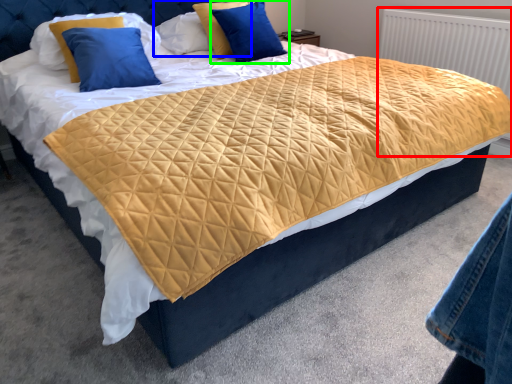
Question: Which object is positioned farthest from radiator (highlighted by a red box)? Select from pillow (highlighted by a blue box) and pillow (highlighted by a green box).

Choices:
 (A) pillow
 (B) pillow

Answer: (A)